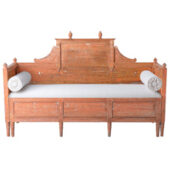
Where is `bench leg 1`? bench leg 1 is located at coordinates (6, 127).